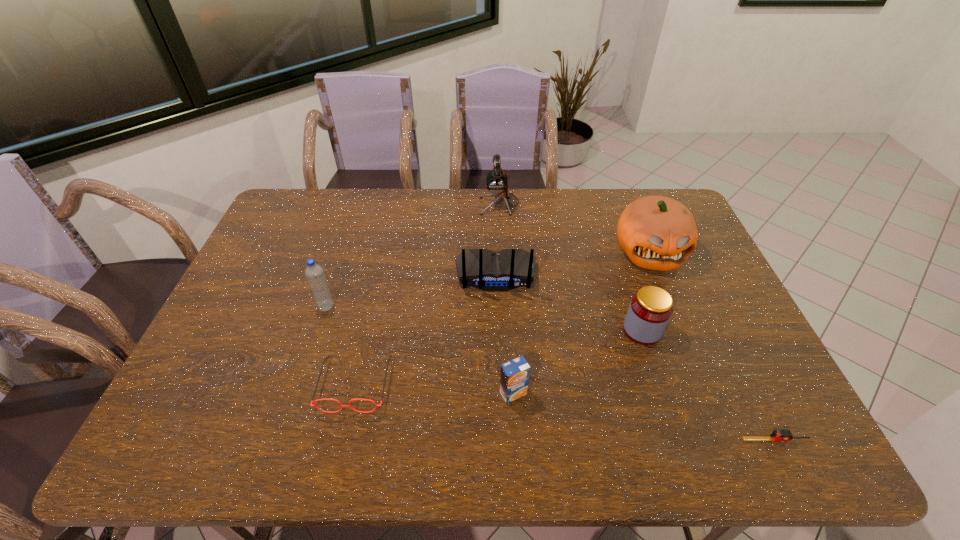
You are a GUI agent. You are given a task and a screenshot of the screen. Output one action in this format:
    pyautogui.click(x=<x>, y=<y>)
    Task: Click on the farthest object
    
    Given the screenshot: What is the action you would take?
    pyautogui.click(x=497, y=183)

Locate an element on the screen. Image resolution: width=960 pixels, height=540 pixels. pumpkin is located at coordinates (657, 233).

The width and height of the screenshot is (960, 540). Find the location of `water bottle`. water bottle is located at coordinates (314, 273).

Find the location of a particular element. Image resolution: width=960 pixels, height=540 pixels. the fourth farthest object is located at coordinates 314,273.

Find the location of `router`. router is located at coordinates (507, 269).

The height and width of the screenshot is (540, 960). What are the coordinates of `the fifth farthest object` in the screenshot? It's located at (649, 312).

In order to click on orange_juice in this screenshot , I will do `click(514, 378)`.

At what (x,y) coordinates should I click in order to perform the action: click on the second shortest object. Please return your answer as a coordinate pair (x, y). The height and width of the screenshot is (540, 960). Looking at the image, I should click on (314, 405).

The width and height of the screenshot is (960, 540). What are the coordinates of `the second object from left to right` in the screenshot? It's located at point(314,405).

Where is `the nearest object`? The height and width of the screenshot is (540, 960). the nearest object is located at coordinates (779, 435).